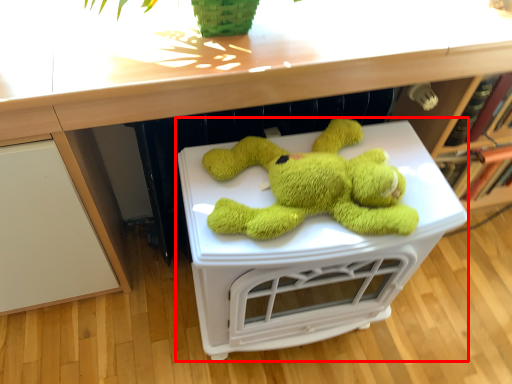
Question: Considering the relative positions of table (annotated by the red box) and counter top in the image provided, where is table (annotated by the red box) located with respect to the staircase?

Choices:
 (A) right
 (B) left

Answer: (B)